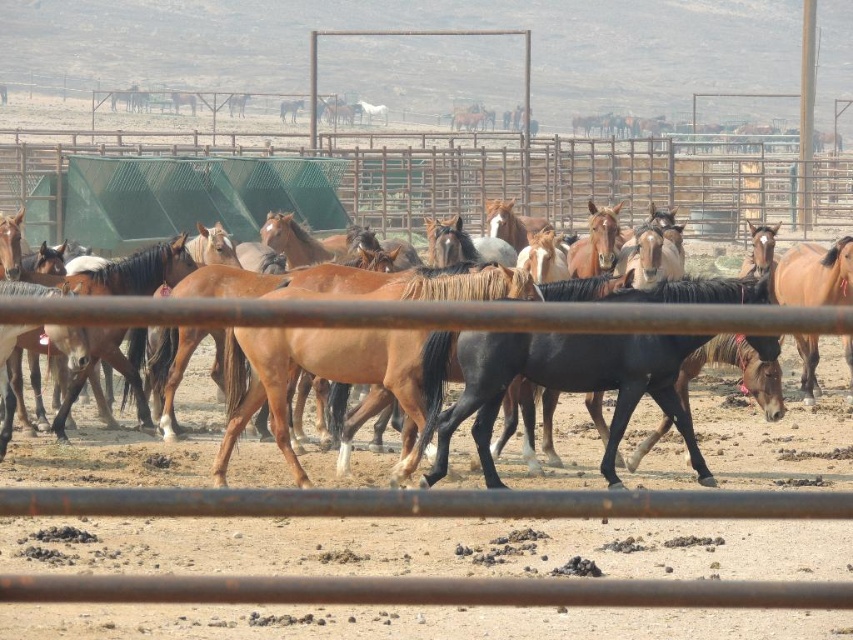
Does green wire mesh fence at upper center have a larger size compared to brown glossy horse at center?

Indeed, green wire mesh fence at upper center has a larger size compared to brown glossy horse at center.

Which of these two, green wire mesh fence at upper center or brown glossy horse at center, stands taller?

With more height is green wire mesh fence at upper center.

Who is more forward, (532, 157) or (294, 321)?

Point (294, 321)

Image resolution: width=853 pixels, height=640 pixels. Find the location of `green wire mesh fence at upper center`. green wire mesh fence at upper center is located at coordinates (407, 182).